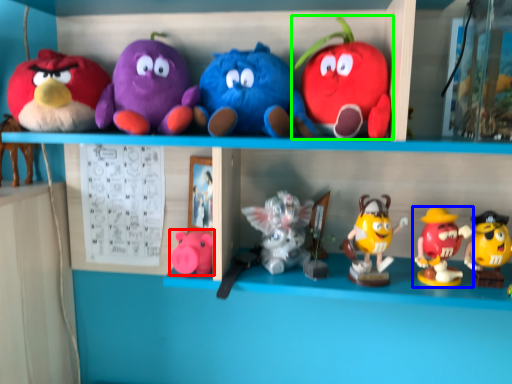
Question: Estimate the real-world distances between objects in this image. Which object is farther from toy (highlighted by a red box), toy (highlighted by a blue box) or toy (highlighted by a green box)?

Choices:
 (A) toy
 (B) toy

Answer: (A)